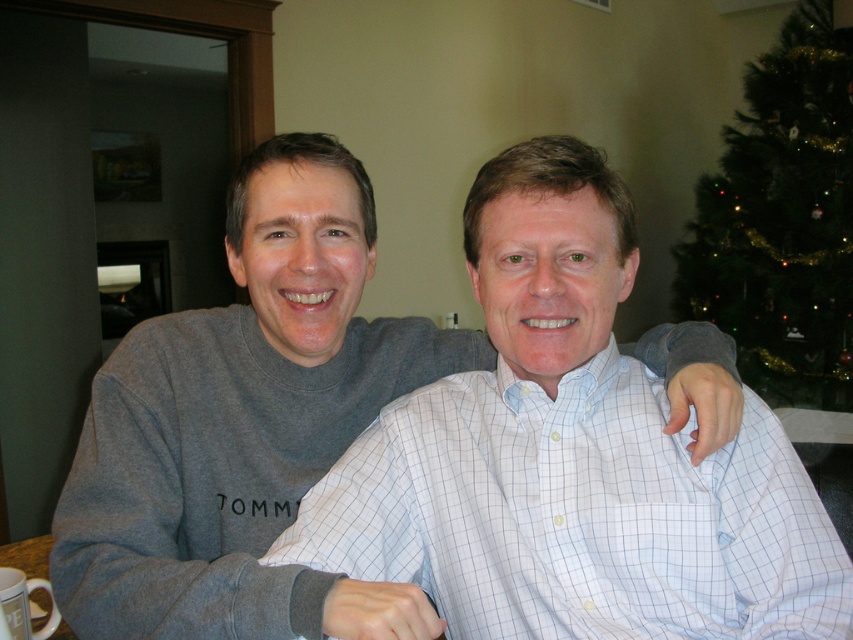
Who is more forward, (65,580) or (798,177)?

Positioned in front is point (65,580).

Measure the distance between point (347, 272) and camera.

They are 3.33 feet apart.

Where is `gray cotton shirt at center`? gray cotton shirt at center is located at coordinates (242, 420).